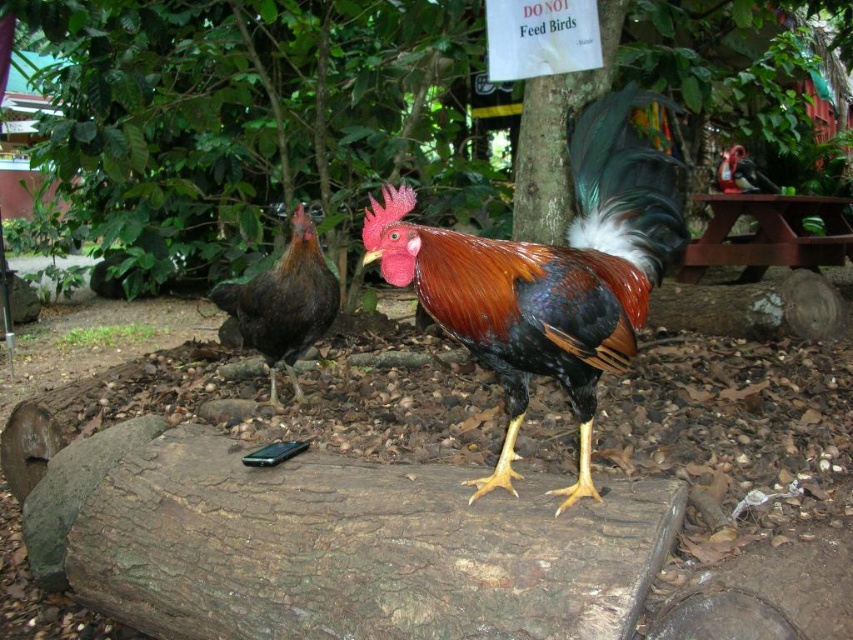
Question: Based on their relative distances, which object is nearer to the dark brown feathers at left?

Choices:
 (A) shiny multicolored rooster at center
 (B) green leafy tree at center

Answer: (A)

Question: Which of the following is the farthest from the observer?

Choices:
 (A) shiny multicolored rooster at center
 (B) dark brown feathers at left
 (C) green leafy tree at center

Answer: (C)

Question: Does green leafy tree at center appear over dark brown feathers at left?

Choices:
 (A) no
 (B) yes

Answer: (B)

Question: Which object is positioned farthest from the shiny multicolored rooster at center?

Choices:
 (A) green leafy tree at center
 (B) dark brown feathers at left

Answer: (A)

Question: Can you confirm if shiny multicolored rooster at center is smaller than dark brown feathers at left?

Choices:
 (A) yes
 (B) no

Answer: (B)

Question: Is shiny multicolored rooster at center positioned at the back of dark brown feathers at left?

Choices:
 (A) no
 (B) yes

Answer: (A)